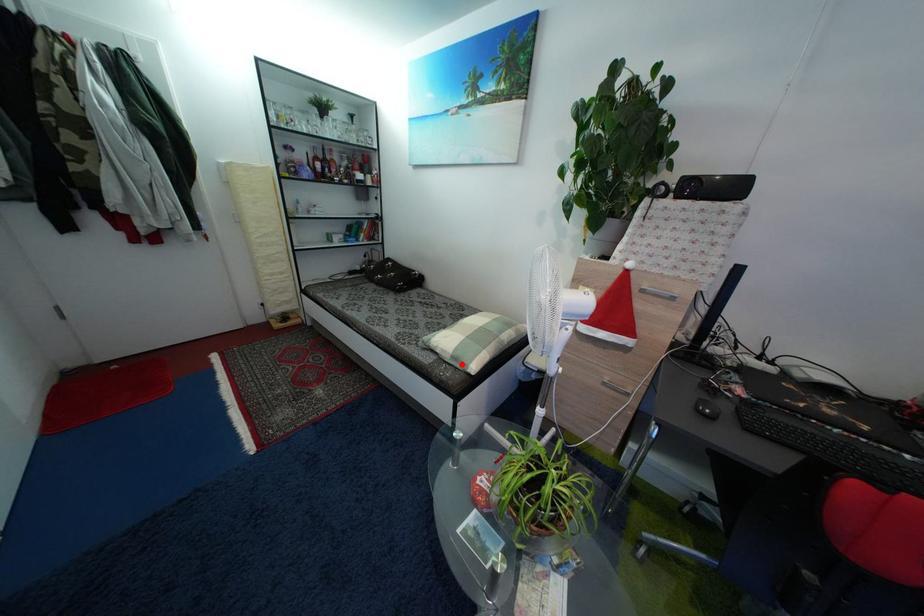
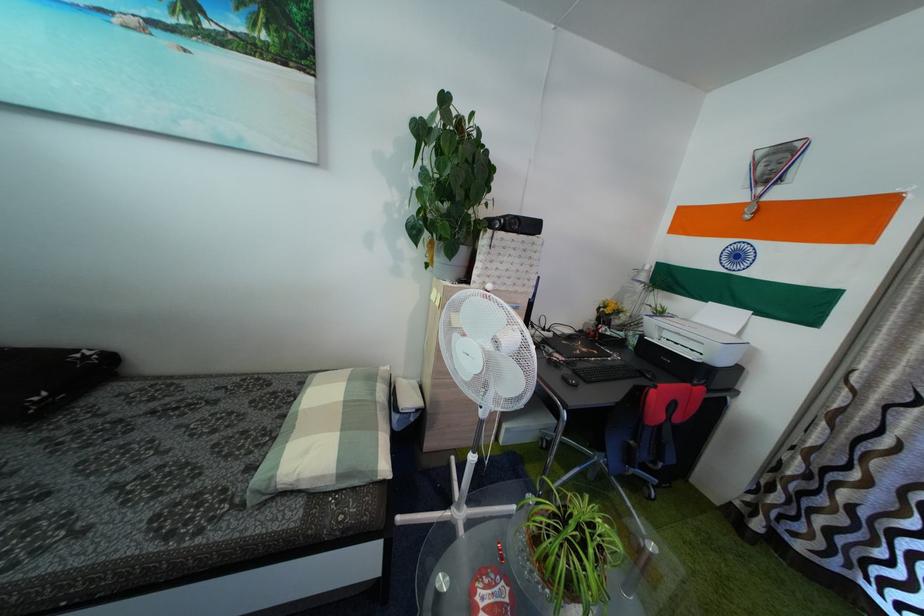
Find the pixel in the second image that matches the highlighted location in the first image.

(347, 483)